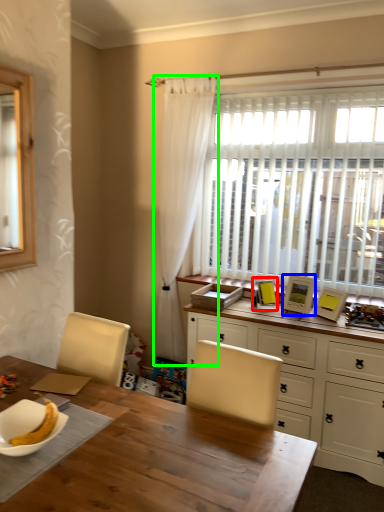
Question: Which object is positioned farthest from picture frame (highlighted by a red box)? Select from picture frame (highlighted by a blue box) and curtain (highlighted by a green box).

Choices:
 (A) picture frame
 (B) curtain

Answer: (B)